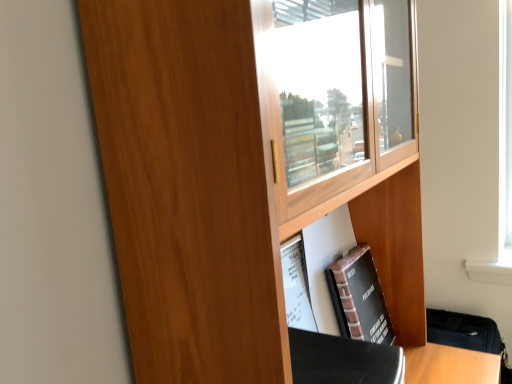
Image resolution: width=512 pixels, height=384 pixels. What are the coordinates of `black matte book at lower right` in the screenshot? It's located at (359, 297).

The height and width of the screenshot is (384, 512). Describe the element at coordinates (359, 297) in the screenshot. I see `black matte book at lower right` at that location.

Where is `wooden cupboard at center`? wooden cupboard at center is located at coordinates (248, 170).

The height and width of the screenshot is (384, 512). What do you see at coordinates (248, 170) in the screenshot? I see `wooden cupboard at center` at bounding box center [248, 170].

What are the coordinates of `black matte book at lower right` in the screenshot? It's located at (359, 297).

Is black matte book at lower right to the right of wooden cupboard at center from the viewer's perspective?

Indeed, black matte book at lower right is positioned on the right side of wooden cupboard at center.

Is the position of black matte book at lower right more distant than that of wooden cupboard at center?

Yes, black matte book at lower right is further from the viewer.

Which is in front, point (336, 283) or point (154, 365)?

Point (154, 365)

From the image's perspective, is black matte book at lower right located above or below wooden cupboard at center?

black matte book at lower right is situated lower than wooden cupboard at center in the image.

From a real-world perspective, does black matte book at lower right sit lower than wooden cupboard at center?

Yes, from a real-world perspective, black matte book at lower right is under wooden cupboard at center.

Considering the sizes of objects black matte book at lower right and wooden cupboard at center in the image provided, who is thinner, black matte book at lower right or wooden cupboard at center?

With smaller width is black matte book at lower right.

Who is shorter, black matte book at lower right or wooden cupboard at center?

With less height is black matte book at lower right.

Between black matte book at lower right and wooden cupboard at center, which one has smaller size?

black matte book at lower right is smaller.

Is wooden cupboard at center completely or partially inside black matte book at lower right?

Actually, wooden cupboard at center is outside black matte book at lower right.

Is black matte book at lower right in contact with wooden cupboard at center?

black matte book at lower right is not next to wooden cupboard at center, and they're not touching.

Is black matte book at lower right turned away from wooden cupboard at center?

That's right, black matte book at lower right is facing away from wooden cupboard at center.

At what (x,y) coordinates should I click in order to perform the action: click on cupboard above the black matte book at lower right (from the image's perspective). Please return your answer as a coordinate pair (x, y). The height and width of the screenshot is (384, 512). Looking at the image, I should click on (248, 170).

Does wooden cupboard at center appear on the right side of black matte book at lower right?

No.

Is wooden cupboard at center further to camera compared to black matte book at lower right?

No, wooden cupboard at center is closer to the viewer.

Between point (199, 248) and point (346, 318), which one is positioned in front?

The point (199, 248) is more forward.

From the image's perspective, is wooden cupboard at center located above black matte book at lower right?

Yes.

From a real-world perspective, who is located lower, wooden cupboard at center or black matte book at lower right?

In real-world perspective, black matte book at lower right is lower.

Between wooden cupboard at center and black matte book at lower right, which one has smaller width?

Thinner between the two is black matte book at lower right.

Is wooden cupboard at center taller than black matte book at lower right?

Yes, wooden cupboard at center is taller than black matte book at lower right.

Considering the sizes of wooden cupboard at center and black matte book at lower right in the image, is wooden cupboard at center bigger or smaller than black matte book at lower right?

wooden cupboard at center is bigger than black matte book at lower right.

Is wooden cupboard at center spatially inside black matte book at lower right, or outside of it?

wooden cupboard at center is located beyond the bounds of black matte book at lower right.

Is wooden cupboard at center touching black matte book at lower right?

No, wooden cupboard at center is not in contact with black matte book at lower right.

Could you tell me if wooden cupboard at center is facing black matte book at lower right?

Yes.

What's the angular difference between wooden cupboard at center and black matte book at lower right's facing directions?

1.23 degrees.

In order to click on book below the wooden cupboard at center (from the image's perspective) in this screenshot , I will do `click(359, 297)`.

Where is `cupboard above the black matte book at lower right (from a real-world perspective)`? cupboard above the black matte book at lower right (from a real-world perspective) is located at coordinates (248, 170).

The image size is (512, 384). I want to click on cupboard that appears in front of the black matte book at lower right, so click(248, 170).